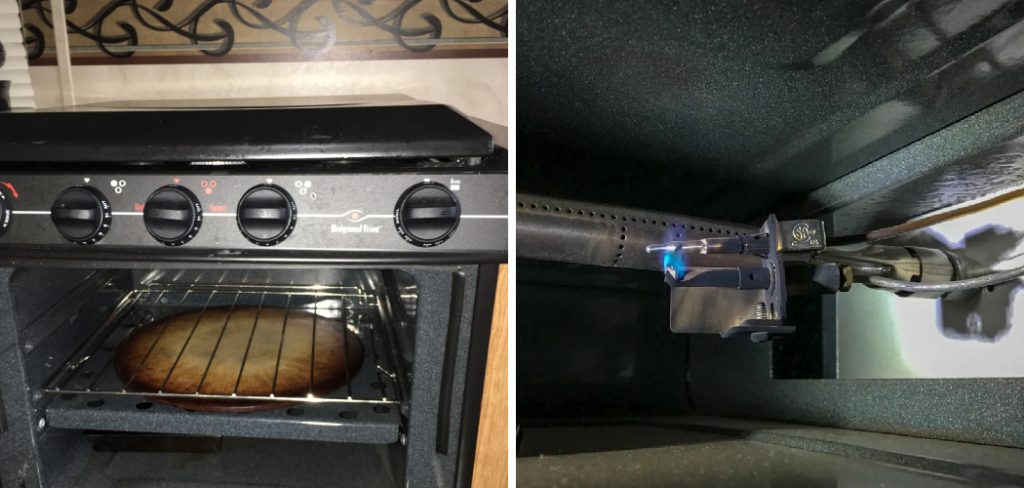
This screenshot has width=1024, height=488. Identify the location of brown ;picture with black swirls. (225, 24).